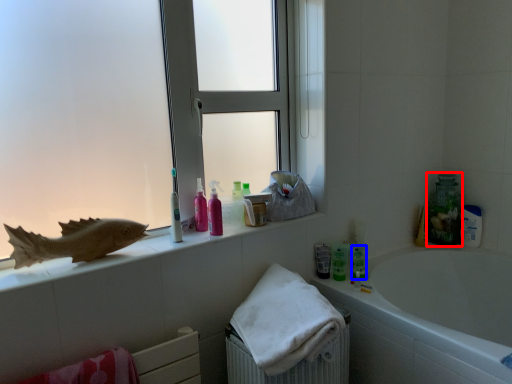
Question: Which object is closer to the camera taking this photo, cleaning product (highlighted by a red box) or toiletry (highlighted by a blue box)?

Choices:
 (A) cleaning product
 (B) toiletry

Answer: (B)